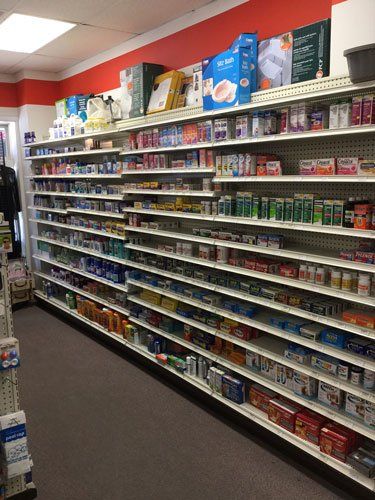
Where is `ceiling panels`? The width and height of the screenshot is (375, 500). ceiling panels is located at coordinates (121, 11), (83, 41), (44, 63), (8, 58), (7, 2), (54, 6).